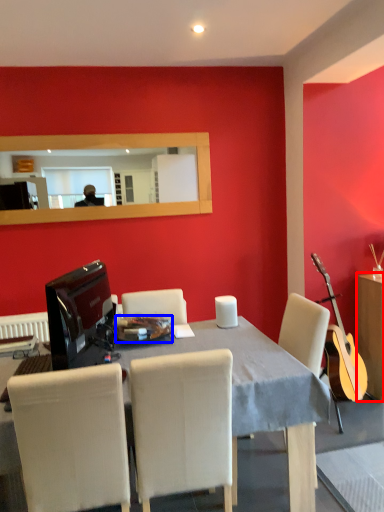
Question: Which object appears farthest to the camera in this image, cabinetry (highlighted by a red box) or plate (highlighted by a blue box)?

Choices:
 (A) cabinetry
 (B) plate

Answer: (A)